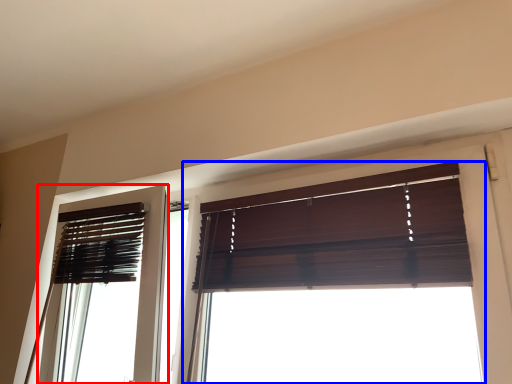
Question: Which object appears closest to the camera in this image, screen door (highlighted by a red box) or window (highlighted by a blue box)?

Choices:
 (A) screen door
 (B) window

Answer: (B)